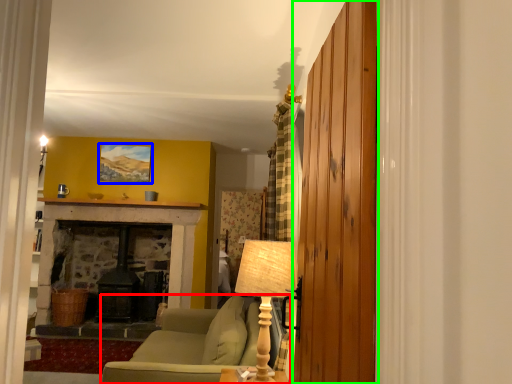
Question: Estimate the real-world distances between objects in this image. Which object is farther from studio couch (highlighted by a red box), picture frame (highlighted by a blue box) or barn door (highlighted by a green box)?

Choices:
 (A) picture frame
 (B) barn door

Answer: (A)